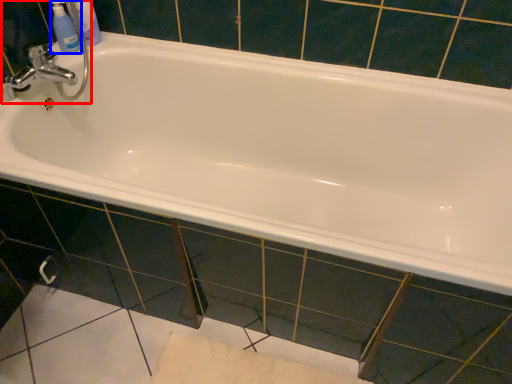
Question: Which object appears closest to the camera in this image, sink (highlighted by a red box) or mouthwash (highlighted by a blue box)?

Choices:
 (A) sink
 (B) mouthwash

Answer: (A)